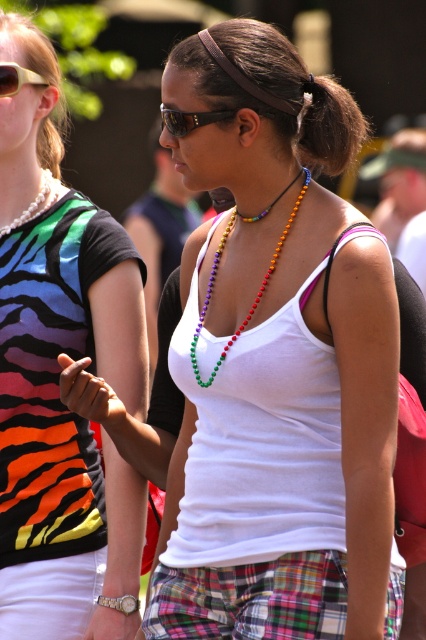
Can you confirm if multicolored beads necklace at center is positioned to the right of matte black sunglasses at upper left?

Correct, you'll find multicolored beads necklace at center to the right of matte black sunglasses at upper left.

Looking at this image, is multicolored beads necklace at center above matte black sunglasses at upper left?

No, multicolored beads necklace at center is not above matte black sunglasses at upper left.

Is point (193, 340) closer to camera compared to point (11, 65)?

Yes, point (193, 340) is in front of point (11, 65).

Image resolution: width=426 pixels, height=640 pixels. I want to click on multicolored beads necklace at center, so click(x=256, y=292).

Is multicolored beads necklace at center taller than pearl necklace at upper left?

Yes.

Can you confirm if multicolored beads necklace at center is positioned below pearl necklace at upper left?

Correct, multicolored beads necklace at center is located below pearl necklace at upper left.

The image size is (426, 640). Find the location of `multicolored beads necklace at center`. multicolored beads necklace at center is located at coordinates (256, 292).

Can you confirm if white matte tank top at center is bigger than matte black sunglasses at upper left?

Correct, white matte tank top at center is larger in size than matte black sunglasses at upper left.

Between point (92, 234) and point (2, 97), which one is positioned behind?

The point (92, 234) is behind.

Identify the location of white matte tank top at center. The width and height of the screenshot is (426, 640). (57, 378).